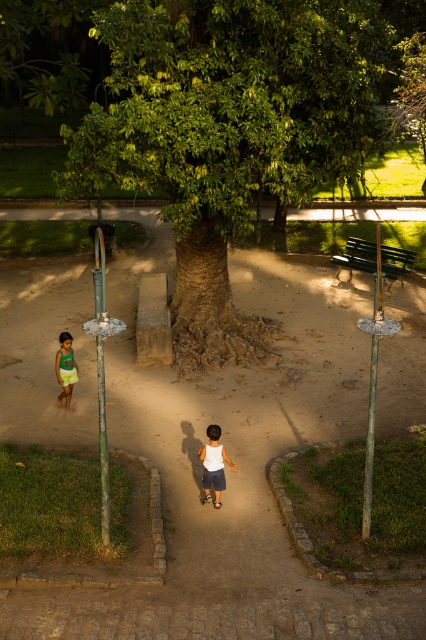
Between brown dirt path at center and green jersey at lower left, which one appears on the left side from the viewer's perspective?

From the viewer's perspective, green jersey at lower left appears more on the left side.

Between point (233, 413) and point (72, 374), which one is positioned in front?

Point (72, 374) is more forward.

Where is `brown dirt path at center`? The height and width of the screenshot is (640, 426). brown dirt path at center is located at coordinates (230, 472).

Does brown dirt path at center appear on the right side of white matte shorts at center?

Incorrect, brown dirt path at center is not on the right side of white matte shorts at center.

Image resolution: width=426 pixels, height=640 pixels. What do you see at coordinates (230, 472) in the screenshot?
I see `brown dirt path at center` at bounding box center [230, 472].

Which is behind, point (296, 305) or point (218, 481)?

The point (296, 305) is more distant.

Locate an element on the screen. The height and width of the screenshot is (640, 426). brown dirt path at center is located at coordinates 230,472.

Is point (180, 620) positioned before point (245, 104)?

Yes, point (180, 620) is in front of point (245, 104).

Which is behind, point (394, 362) or point (285, 173)?

The point (394, 362) is more distant.

Find the location of a particular element. brown dirt path at center is located at coordinates (230, 472).